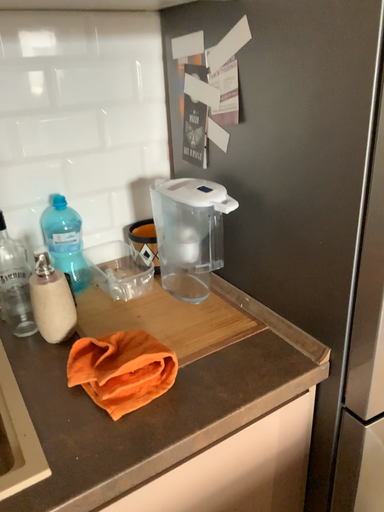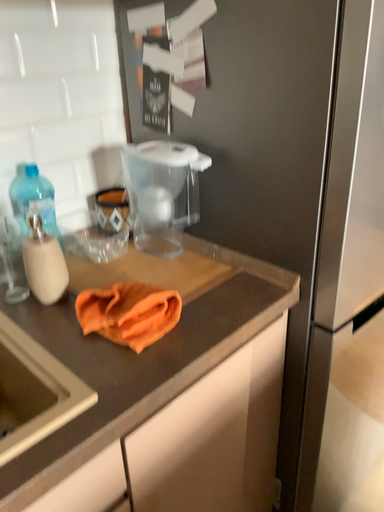
Question: Which way did the camera rotate in the video?

Choices:
 (A) rotated right
 (B) rotated left

Answer: (A)